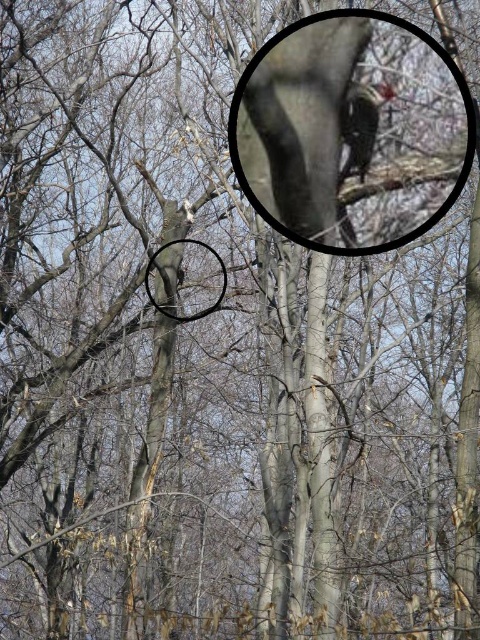
You are a birdwatcher trying to observe the smooth brown woodpecker at upper center. There is a smooth gray basketball hoop at center in the way. Can you see the woodpecker clearly through the hoop?

Answer: Yes, the smooth brown woodpecker at upper center is in front of the smooth gray basketball hoop at center, so it should be visible without obstruction from the hoop.

You are a birdwatcher trying to photograph the smooth brown woodpecker at upper center and the smooth gray basketball hoop at center. Which object is narrower in width?

The smooth brown woodpecker at upper center is narrower in width than the smooth gray basketball hoop at center.

You are standing in the forest and want to take a photo of the smooth brown woodpecker at upper center. If your camera has a maximum focus range of 25 feet, will you be able to capture a clear photo of it?

The smooth brown woodpecker at upper center and the camera are 24.05 feet apart. Since the distance is within the camera maximum focus range of 25 feet, the camera can focus on the smooth brown woodpecker at upper center and capture a clear photo.